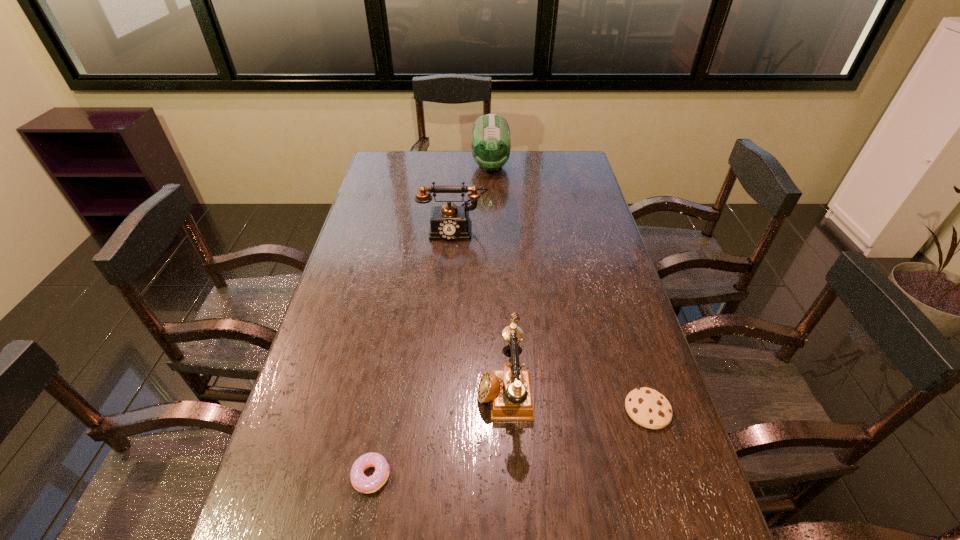
Locate an element on the screen. free location located 0.080m on the front of the cookie is located at coordinates (664, 466).

The width and height of the screenshot is (960, 540). Identify the location of free space located on the back of the doughnut. (391, 363).

Find the location of a particular element. object positioned at the far edge is located at coordinates (491, 140).

I want to click on object that is positioned at the right edge, so click(x=648, y=408).

Where is `free space at the far edge`? This screenshot has width=960, height=540. free space at the far edge is located at coordinates (457, 161).

Where is `vacant area at the left edge`? This screenshot has height=540, width=960. vacant area at the left edge is located at coordinates (400, 219).

Where is `vacant space at the right edge`? vacant space at the right edge is located at coordinates (624, 306).

The width and height of the screenshot is (960, 540). I want to click on vacant area at the far left corner of the desktop, so click(384, 178).

The image size is (960, 540). Find the location of `vacant area that lies between the nearest object and the rightmost object`. vacant area that lies between the nearest object and the rightmost object is located at coordinates pos(509,443).

The height and width of the screenshot is (540, 960). What are the coordinates of `blank region between the football helmet and the nearer telephone` in the screenshot? It's located at (497, 277).